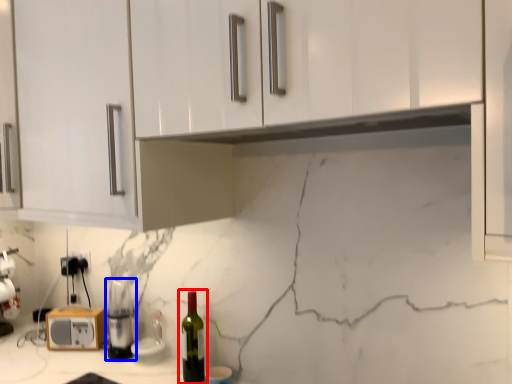
Question: Among these objects, which one is farthest to the camera, bottle (highlighted by a red box) or appliance (highlighted by a blue box)?

Choices:
 (A) bottle
 (B) appliance

Answer: (B)